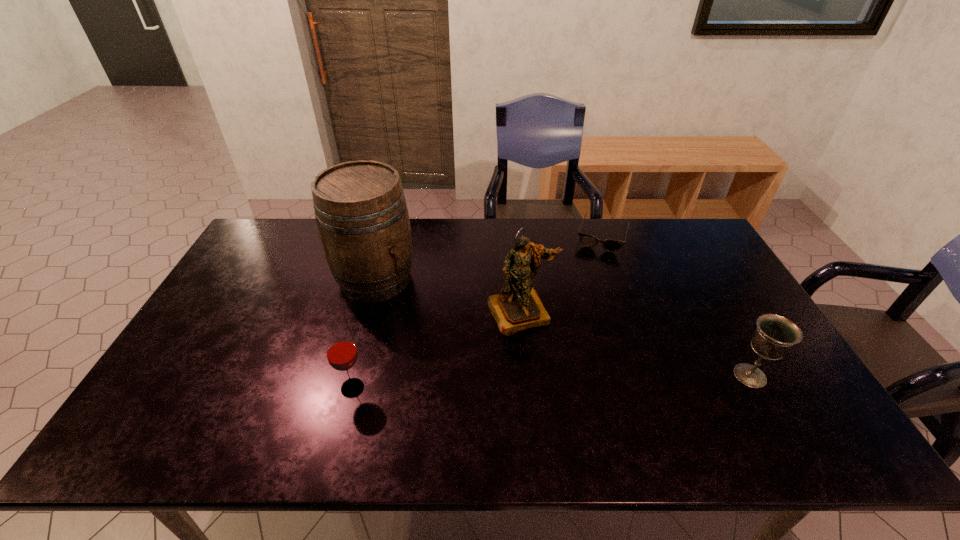
Find the location of a particular element. The height and width of the screenshot is (540, 960). free spot between the third object from right to left and the cider is located at coordinates (448, 295).

The image size is (960, 540). In order to click on free space between the figurine and the shortest object in this screenshot , I will do `click(562, 274)`.

Where is `free space between the cider and the rightmost object`? free space between the cider and the rightmost object is located at coordinates (563, 327).

At what (x,y) coordinates should I click in order to perform the action: click on blank region between the figurine and the rightmost object. Please return your answer as a coordinate pair (x, y). Looking at the image, I should click on (636, 344).

Identify the location of free space between the second tallest object and the rightmost object. (636, 344).

Where is `free space between the rightmost object and the third object from right to left`? free space between the rightmost object and the third object from right to left is located at coordinates (x=636, y=344).

The image size is (960, 540). What are the coordinates of `free spot between the glass and the tallest object` in the screenshot? It's located at (364, 333).

Find the location of a particular element. free space between the rightmost object and the cider is located at coordinates (563, 327).

Identify the location of object that can be found as the third closest to the cider. (610, 245).

Find the location of a particular element. Image resolution: width=960 pixels, height=540 pixels. object that ranks as the second closest to the glass is located at coordinates (518, 306).